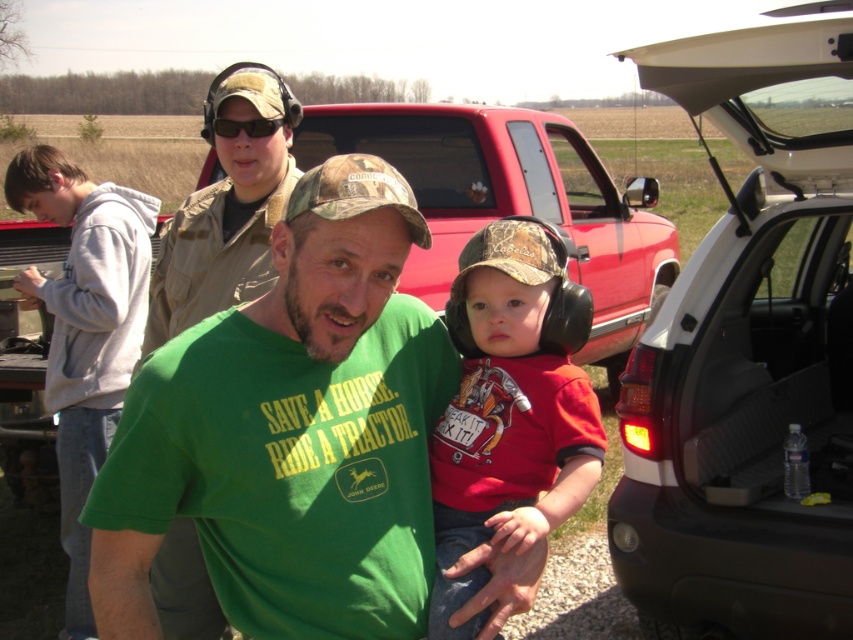
Question: Is black plastic car at right smaller than gray hoodie at left?

Choices:
 (A) no
 (B) yes

Answer: (A)

Question: In this image, where is green cotton t-shirt at center located relative to black plastic car at right?

Choices:
 (A) above
 (B) below

Answer: (B)

Question: Does green cotton t-shirt at center have a larger size compared to gray hoodie at left?

Choices:
 (A) no
 (B) yes

Answer: (A)

Question: Which of these objects is positioned closest to the black plastic suv at right?

Choices:
 (A) black plastic car at right
 (B) gray hoodie at left

Answer: (A)

Question: Considering the real-world distances, which object is farthest from the black plastic car at right?

Choices:
 (A) gray hoodie at left
 (B) khaki fabric truck at upper center
 (C) black plastic suv at right

Answer: (A)

Question: Which of the following is the closest to the observer?

Choices:
 (A) (686, 65)
 (B) (80, 353)
 (C) (212, 445)
 (D) (184, 262)

Answer: (C)